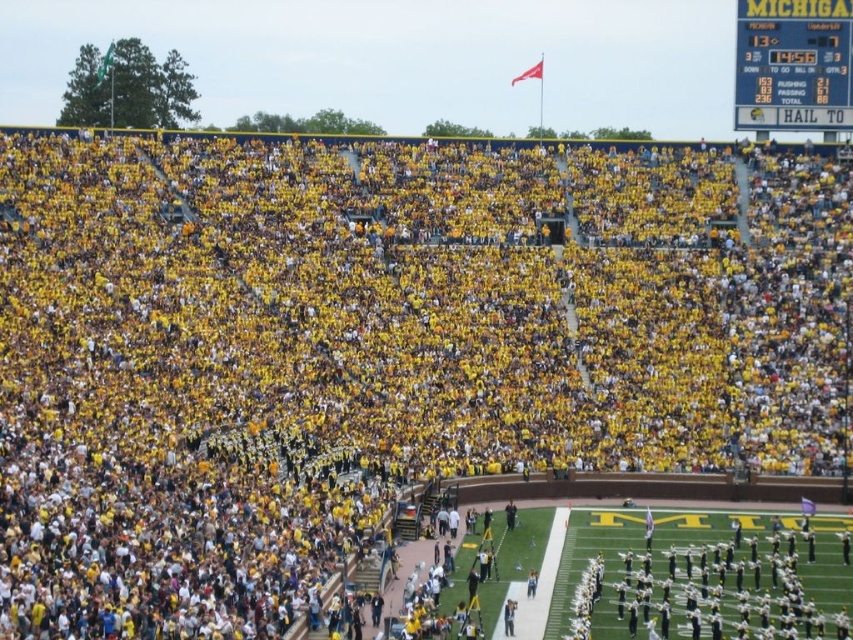
Does white uniformed band at lower right lie in front of yellow plastic scoreboard at upper right?

Yes, white uniformed band at lower right is in front of yellow plastic scoreboard at upper right.

Which is more to the right, white uniformed band at lower right or yellow plastic scoreboard at upper right?

yellow plastic scoreboard at upper right is more to the right.

The height and width of the screenshot is (640, 853). What do you see at coordinates (706, 577) in the screenshot?
I see `white uniformed band at lower right` at bounding box center [706, 577].

The height and width of the screenshot is (640, 853). I want to click on white uniformed band at lower right, so click(x=706, y=577).